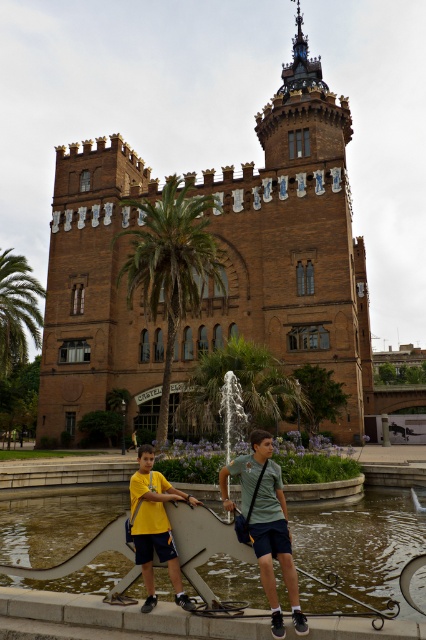
You are a maintenance worker needing to place a 3m long decorative bench on the gray concrete ledge at lower center or the green leafy palm tree at left. Based on their widths, which location can accommodate the bench?

The gray concrete ledge at lower center is wider than the green leafy palm tree at left, so the bench can be placed on the gray concrete ledge at lower center.